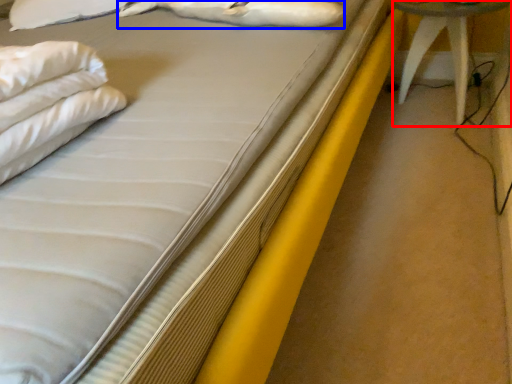
Question: Which object is closer to the camera taking this photo, furniture (highlighted by a red box) or animal (highlighted by a blue box)?

Choices:
 (A) furniture
 (B) animal

Answer: (B)